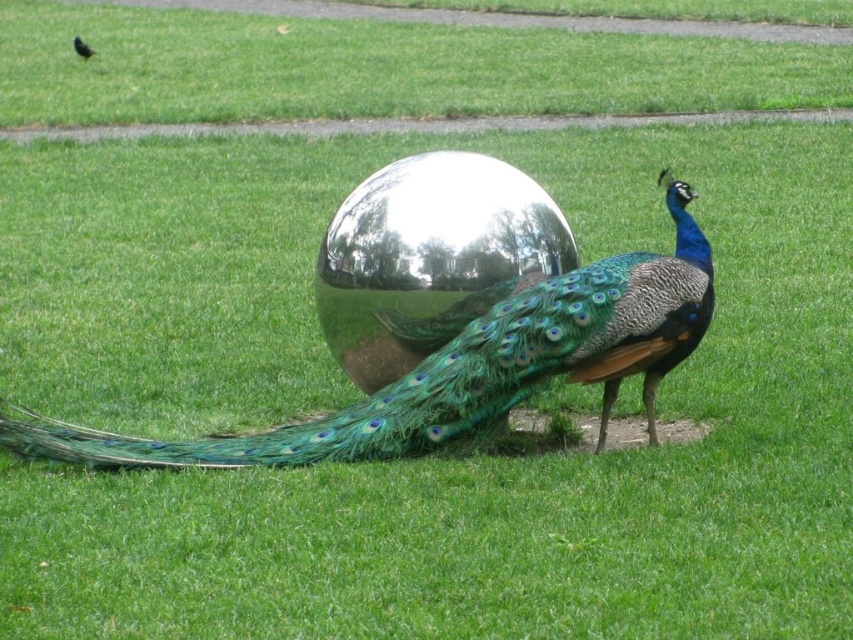
You are standing at the point closest to the peacock. Which point, point (x=518, y=259) or point (x=85, y=58), is closer to you?

Point (x=85, y=58) is closer to you because it is behind point (x=518, y=259), which is in front of it.

You are standing at the point with coordinates point (370, 298) and want to walk to the peacock. Which direction should you move relative to point (622, 368)?

You should move towards point (622, 368) because it is in front of point (370, 298), so moving towards it would lead you closer to the peacock.